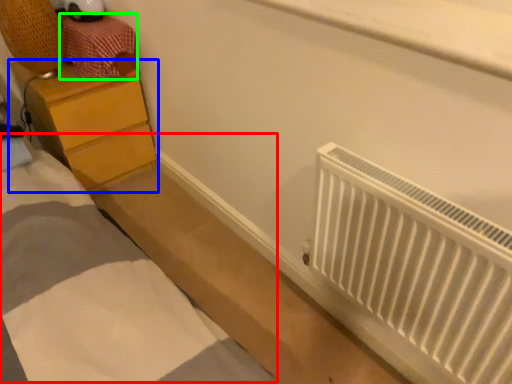
Question: Based on their relative distances, which object is farther from bed (highlighted by a red box)? Choose from chest of drawers (highlighted by a blue box) and drawer (highlighted by a green box).

Choices:
 (A) chest of drawers
 (B) drawer

Answer: (B)